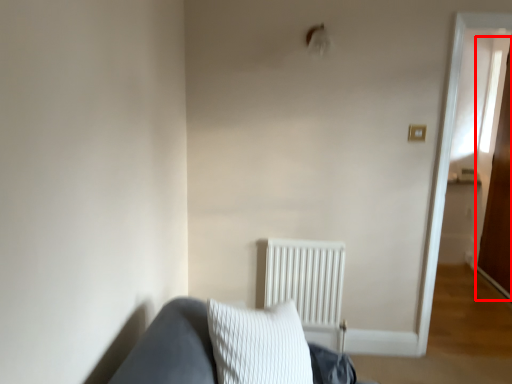
Question: Observing the image, what is the correct spatial positioning of glass door (annotated by the red box) in reference to radiator?

Choices:
 (A) left
 (B) right

Answer: (B)